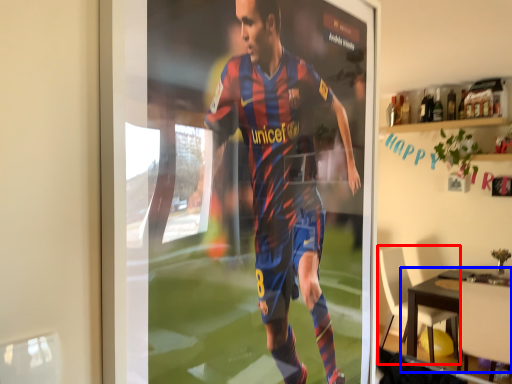
Question: Which of the following is the farthest to the observer, chair (highlighted by a red box) or table (highlighted by a blue box)?

Choices:
 (A) chair
 (B) table

Answer: (A)